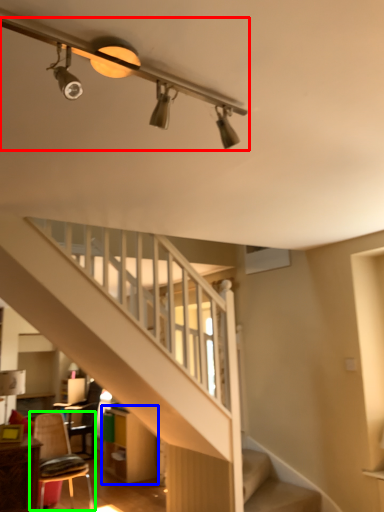
Question: Which object is the farthest from light fixture (highlighted by a red box)? Choose among these: dresser (highlighted by a blue box) or chair (highlighted by a green box).

Choices:
 (A) dresser
 (B) chair

Answer: (A)